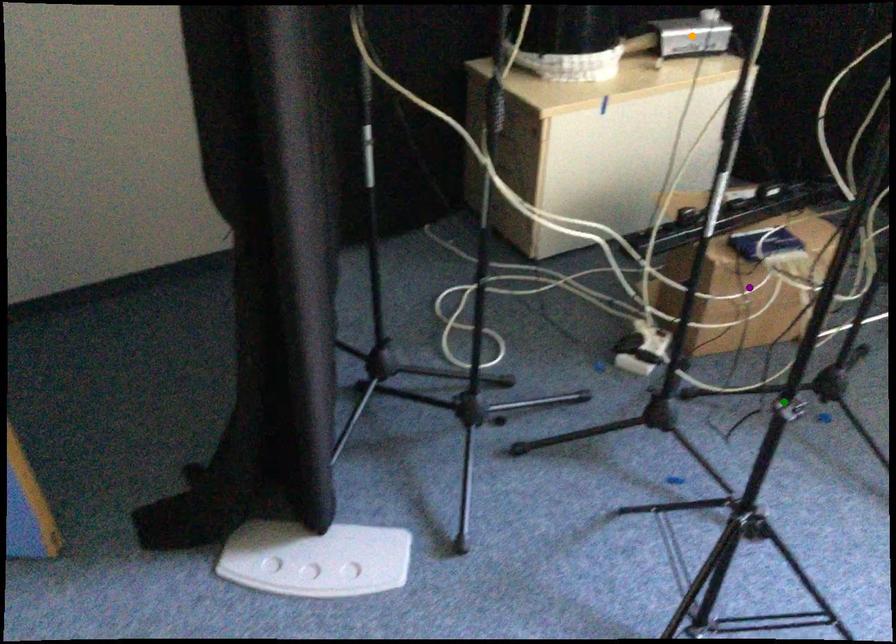
Order these from nearest to farthest:
A) orange point
B) green point
C) purple point

green point → purple point → orange point